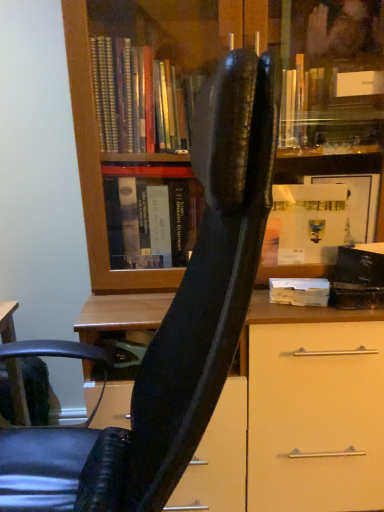
Question: Is black leather chair at center surrounding wooden block at center?

Choices:
 (A) yes
 (B) no

Answer: (B)

Question: From a real-world perspective, is black leather chair at center located higher than wooden block at center?

Choices:
 (A) no
 (B) yes

Answer: (A)

Question: Is black leather chair at center thinner than wooden block at center?

Choices:
 (A) no
 (B) yes

Answer: (A)

Question: From the image's perspective, is black leather chair at center beneath wooden block at center?

Choices:
 (A) yes
 (B) no

Answer: (A)

Question: Can you confirm if black leather chair at center is smaller than wooden block at center?

Choices:
 (A) yes
 (B) no

Answer: (B)

Question: Does black leather chair at center have a larger size compared to wooden block at center?

Choices:
 (A) yes
 (B) no

Answer: (A)

Question: Is wooden block at center not near black leather chair at center?

Choices:
 (A) yes
 (B) no

Answer: (B)

Question: Is wooden block at center taller than black leather chair at center?

Choices:
 (A) no
 (B) yes

Answer: (A)

Question: Does wooden block at center have a larger size compared to black leather chair at center?

Choices:
 (A) no
 (B) yes

Answer: (A)

Question: Is wooden block at center aimed at black leather chair at center?

Choices:
 (A) yes
 (B) no

Answer: (B)

Question: From a real-world perspective, is wooden block at center positioned over black leather chair at center based on gravity?

Choices:
 (A) no
 (B) yes

Answer: (B)

Question: Does wooden block at center have a lesser height compared to black leather chair at center?

Choices:
 (A) no
 (B) yes

Answer: (B)

Question: In terms of width, does wooden block at center look wider or thinner when compared to black leather chair at center?

Choices:
 (A) thin
 (B) wide

Answer: (A)